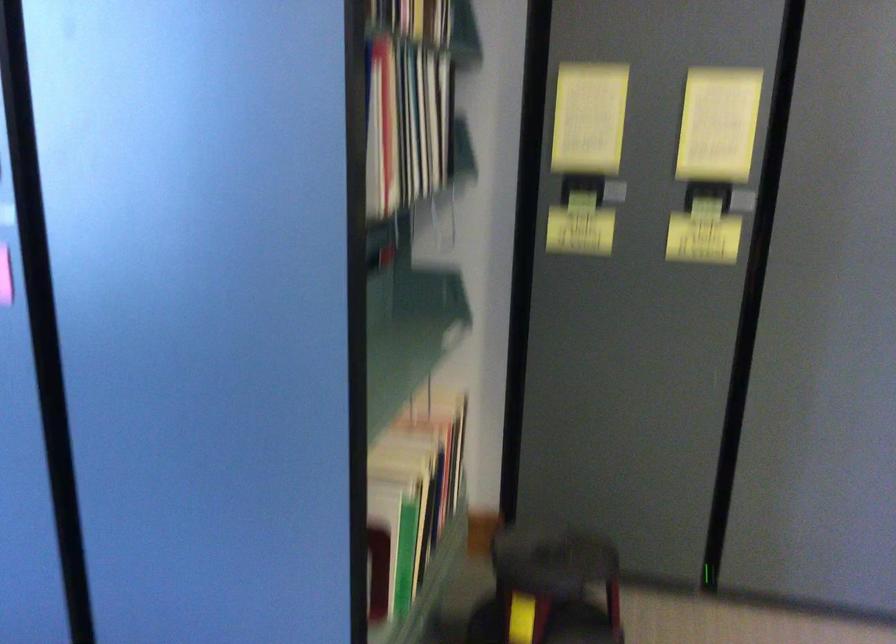
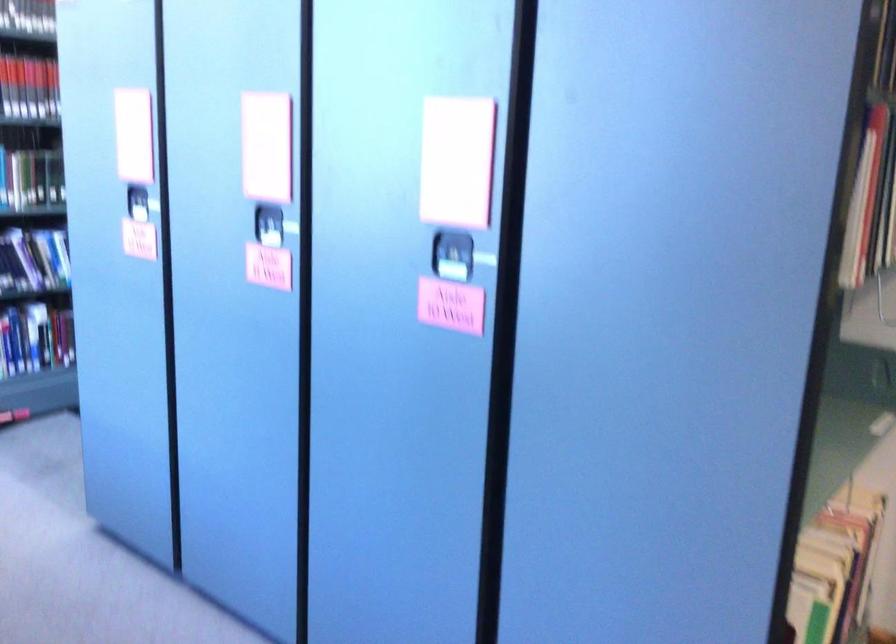
Question: The first image is from the beginning of the video and the second image is from the end. How did the camera likely rotate when shooting the video?

Choices:
 (A) Left
 (B) Right
 (C) Up
 (D) Down

Answer: (A)